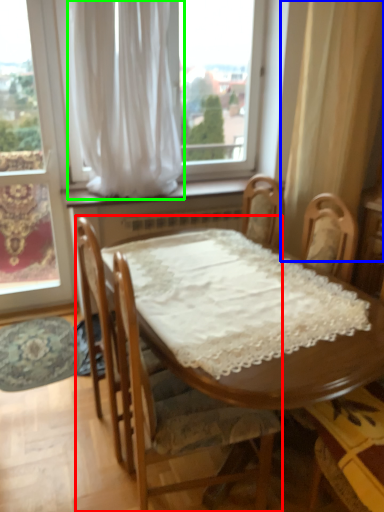
Question: Based on their relative distances, which object is nearer to chair (highlighted by a red box)? Choose from curtain (highlighted by a blue box) and curtain (highlighted by a green box).

Choices:
 (A) curtain
 (B) curtain

Answer: (B)